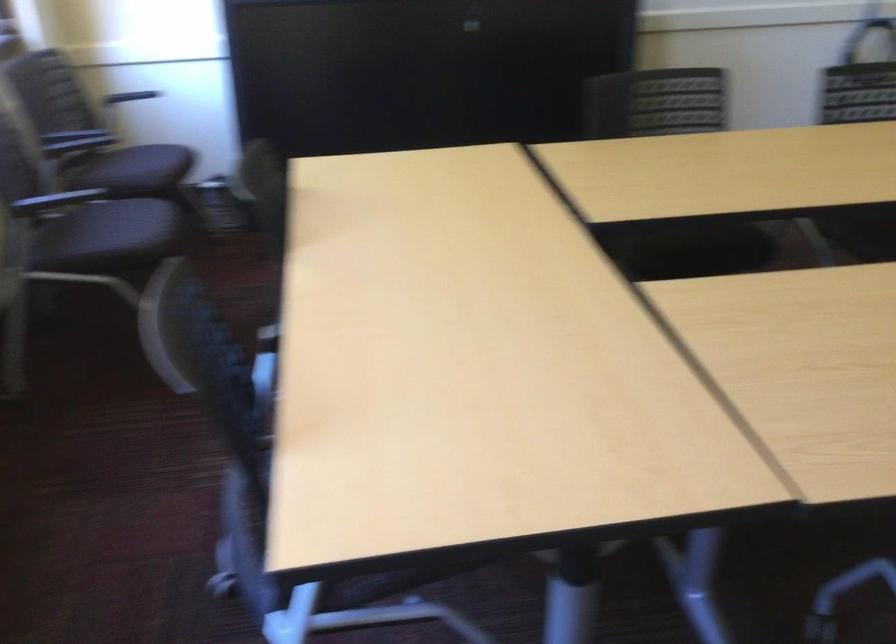
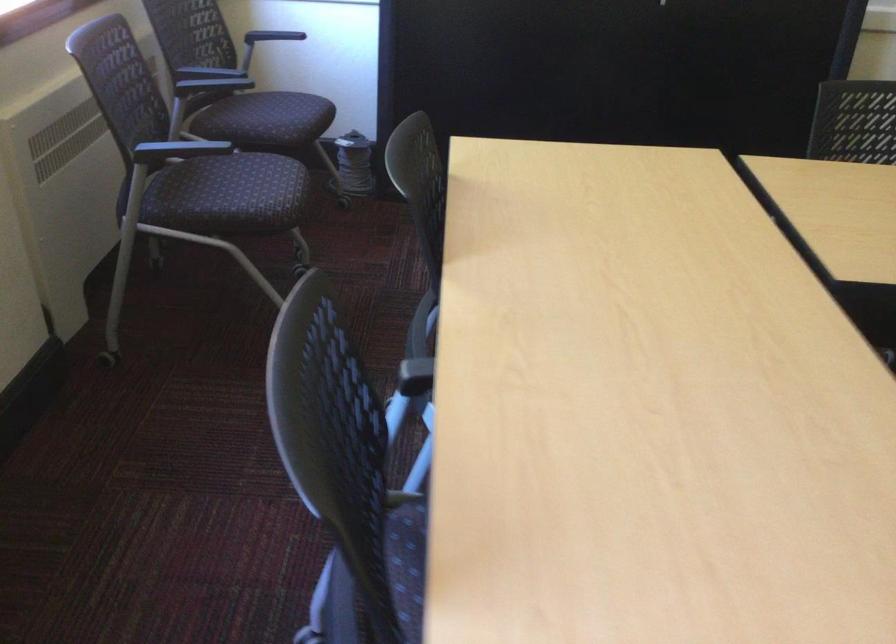
In a continuous first-person perspective shot, in which direction is the camera moving?

The movement direction of the cameraman is left, forward.